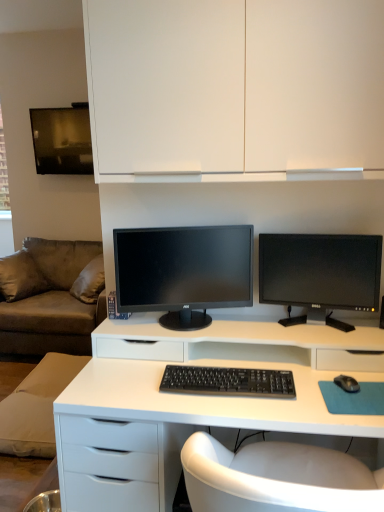
Find the location of `empty space that is ontop of teal fabric mousepad at lower right (from a real-world perspective)`. empty space that is ontop of teal fabric mousepad at lower right (from a real-world perspective) is located at coordinates (366, 393).